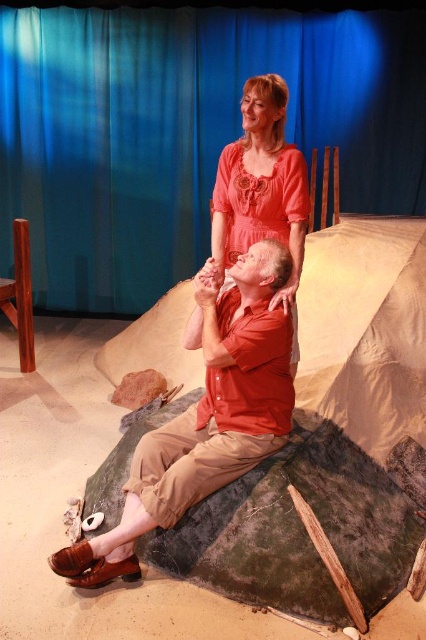
Question: Is blue fabric curtain at upper center wider than matte red shirt at center?

Choices:
 (A) yes
 (B) no

Answer: (A)

Question: Does blue fabric curtain at upper center have a greater width compared to matte red shirt at center?

Choices:
 (A) no
 (B) yes

Answer: (B)

Question: Which of these objects is positioned closest to the matte orange dress at upper center?

Choices:
 (A) blue fabric curtain at upper center
 (B) matte red shirt at center

Answer: (B)

Question: Does matte red shirt at center have a lesser width compared to matte orange dress at upper center?

Choices:
 (A) yes
 (B) no

Answer: (B)

Question: Which point is closer to the camera?

Choices:
 (A) matte red shirt at center
 (B) blue fabric curtain at upper center
 (C) matte orange dress at upper center

Answer: (A)

Question: Which point is closer to the camera taking this photo?

Choices:
 (A) (255, 216)
 (B) (134, 32)
 (C) (282, 321)

Answer: (C)